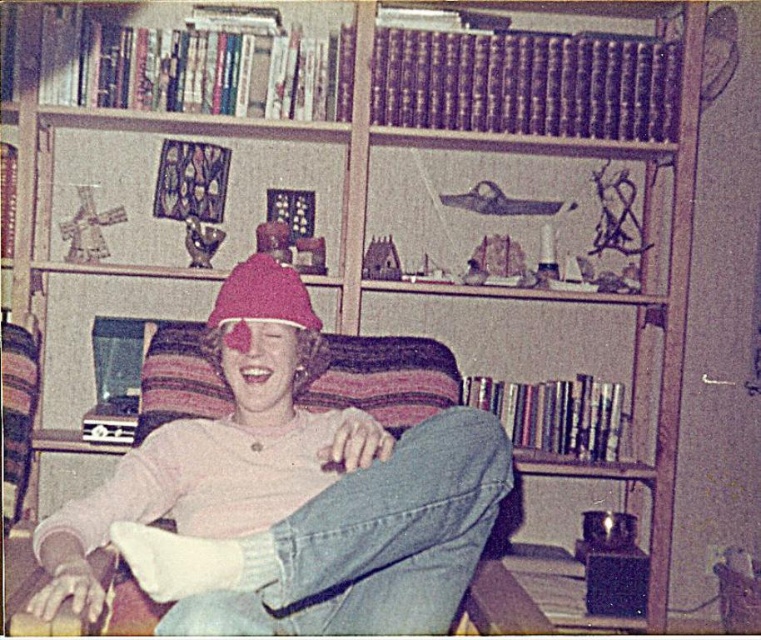
Is pink matte hat at center shorter than fuzzy pink beanie at center?

No.

Is point (62, 536) closer to viewer compared to point (291, 310)?

Yes.

Locate an element on the screen. The image size is (761, 640). pink matte hat at center is located at coordinates pyautogui.click(x=288, y=493).